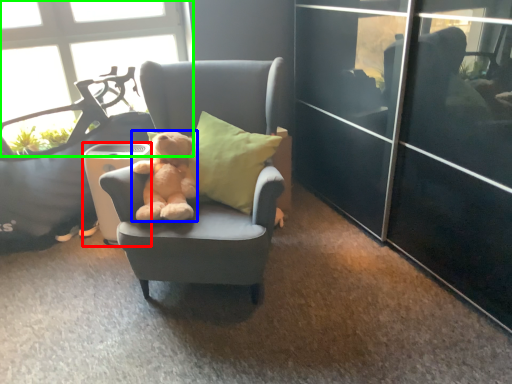
Question: Considering the real-world distances, which object is closest to trash bin/can (highlighted by a red box)? teddy bear (highlighted by a blue box) or window (highlighted by a green box).

Choices:
 (A) teddy bear
 (B) window

Answer: (A)